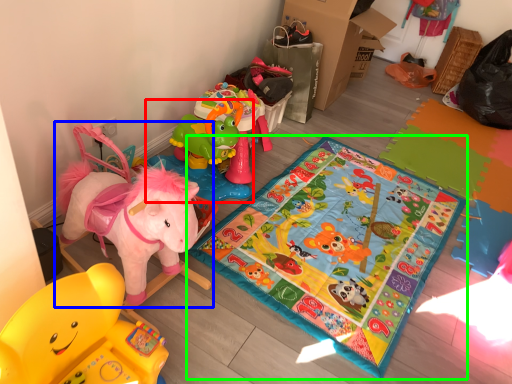
Question: Which is nearer to the toy (highlighted by a red box)? toy (highlighted by a blue box) or yoga mat (highlighted by a green box).

Choices:
 (A) toy
 (B) yoga mat

Answer: (B)